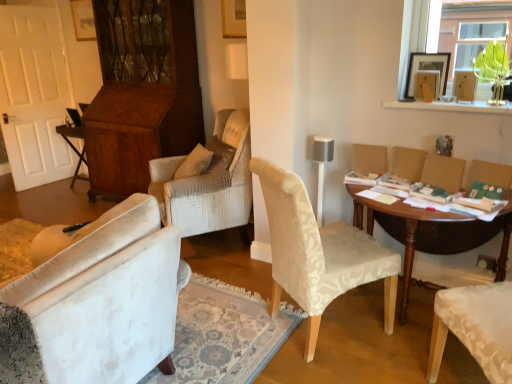
Question: Which is correct: wooden folding table at left, placed as the second table when sorted from right to left, is inside transparent glass vase at upper right, or outside of it?

Choices:
 (A) outside
 (B) inside

Answer: (A)

Question: Is wooden folding table at left, placed as the second table when sorted from right to left, wider or thinner than transparent glass vase at upper right?

Choices:
 (A) wide
 (B) thin

Answer: (A)

Question: Which object is positioned closest to the light beige fabric chair at center?

Choices:
 (A) wooden folding table at left, positioned as the second table in front-to-back order
 (B) transparent glass vase at upper right
 (C) matte beige armchair at right, marked as the 3th armchair in a right-to-left arrangement
 (D) wooden picture frame at upper right
 (E) teal fabric armchair at right, placed as the 3th armchair when sorted from left to right

Answer: (C)

Question: Which object is positioned farthest from the transparent glass vase at upper right?

Choices:
 (A) wooden table at center, which is the second table in back-to-front order
 (B) wooden picture frame at upper right
 (C) matte beige armchair at right, marked as the 3th armchair in a right-to-left arrangement
 (D) teal fabric armchair at right, placed as the 3th armchair when sorted from left to right
 (E) wooden folding table at left, which appears as the 1th table when viewed from the back

Answer: (E)